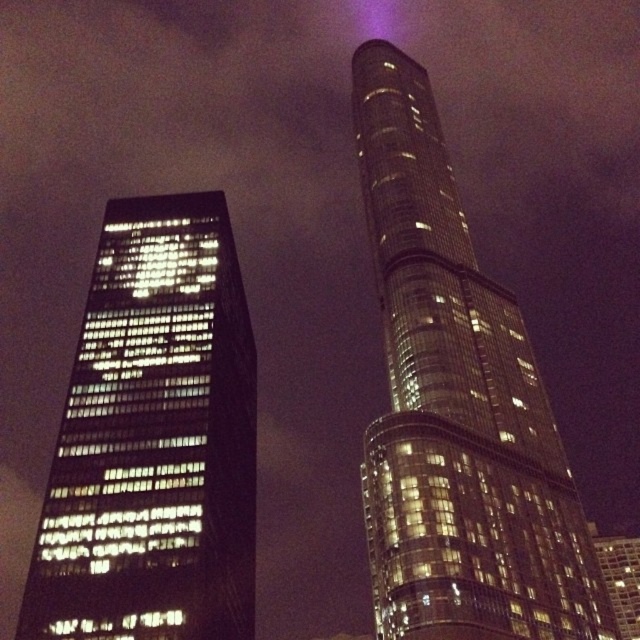
You are an architect analyzing the urban skyline. Given that the glossy glass tower at upper center and the black glass building at left are both visible in the night scene, which one appears higher in the image?

The glossy glass tower at upper center appears higher because it is positioned above the black glass building at left.

You are an architect evaluating the two buildings in the image. The glossy glass tower at upper center and the black glass building at left. Which one is taller?

The glossy glass tower at upper center is taller than the black glass building at left.